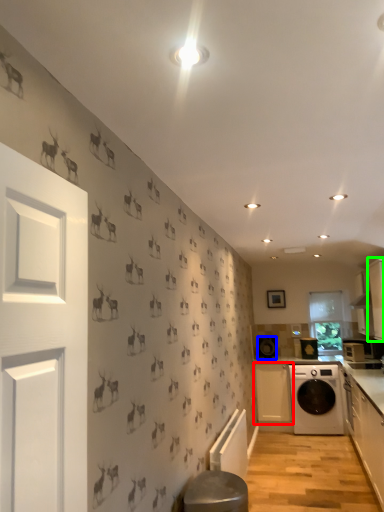
Question: Which object is the closest to the cabinetry (highlighted by a red box)? Choose among these: appliance (highlighted by a blue box) or cabinetry (highlighted by a green box).

Choices:
 (A) appliance
 (B) cabinetry

Answer: (A)